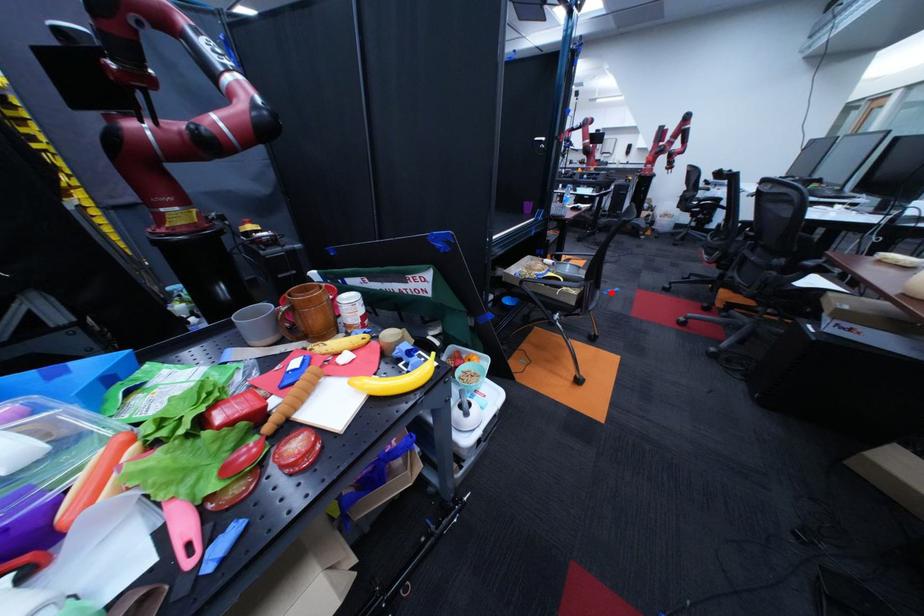
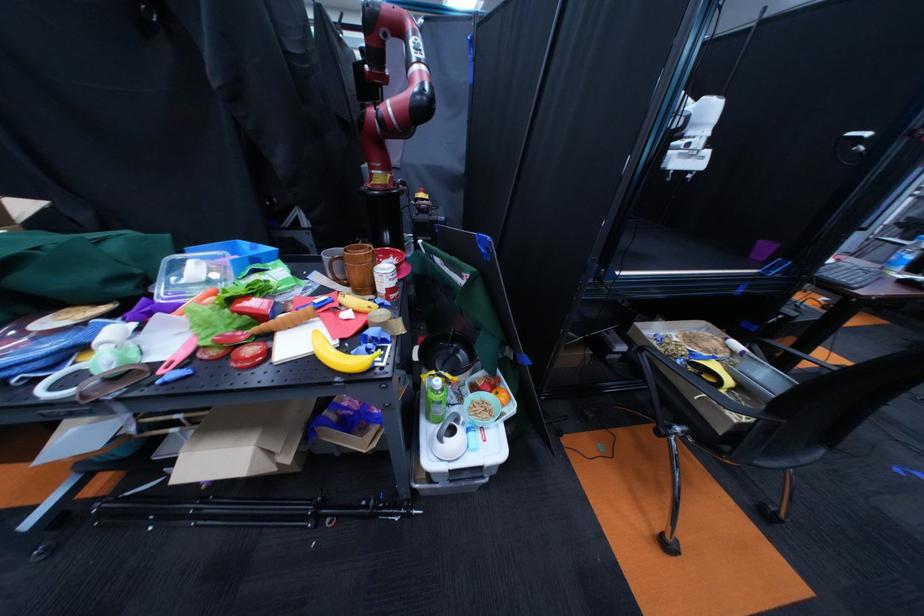
Question: I am providing you with two images of the same scene from different viewpoints. A red point is shown in image1. For the corresponding object point in image2, is it positioned nearer or farther from the camera?

Choices:
 (A) Nearer
 (B) Farther

Answer: (A)